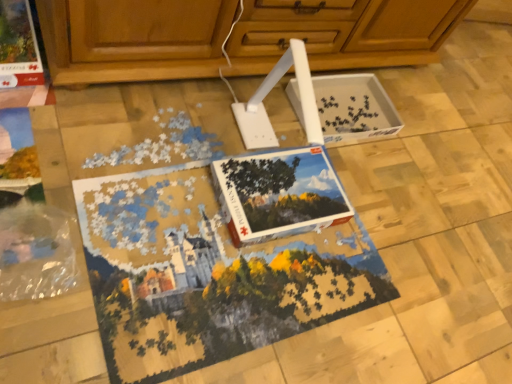
What are the coordinates of `vacant point to the right of matte cardboard magazine at upper left, the 2th magazine ordered from the bottom` in the screenshot? It's located at (84, 115).